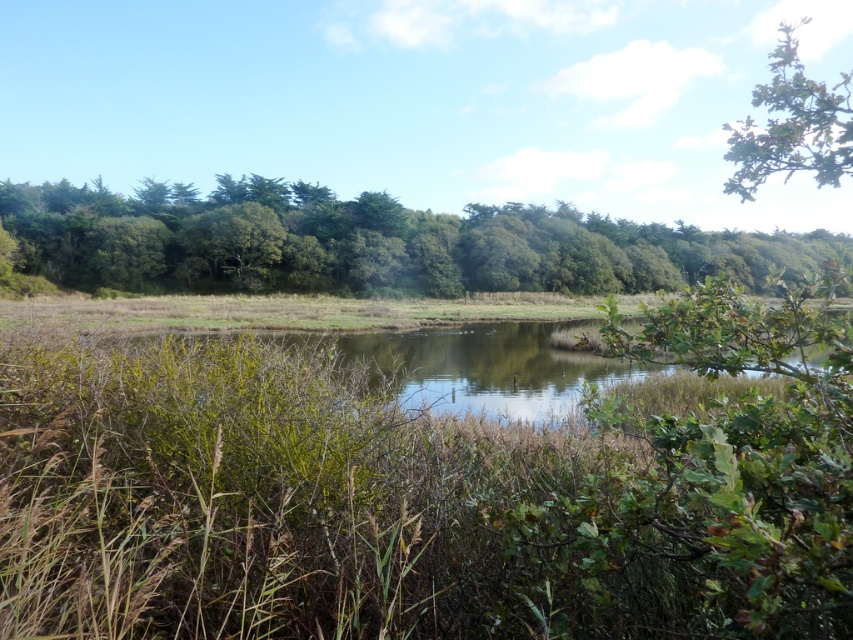
You are an environmental researcher observing the landscape. You notice the green leafy trees at center and the green leafy tree at upper right. Which tree group has a greater height?

The green leafy tree at upper right is taller than the green leafy trees at center.

Based on the scene description and the coordinates provided, what does the point at (369, 243) represent?

The point at (369, 243) represents green leafy trees at center.